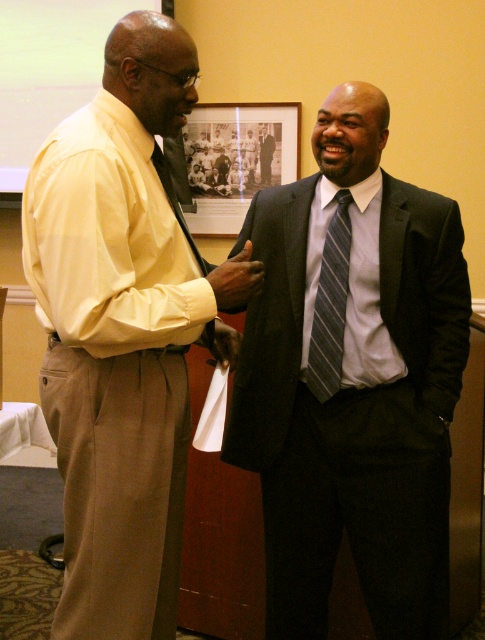
In the scene shown: You are a photographer at a formal event and need to ensure that both the light blue cotton dress shirt at center and the matte black phone at center are clearly visible in your photo. Given their sizes, which object will require more space in the frame to capture its details?

The light blue cotton dress shirt at center is larger in size than the matte black phone at center, so it will require more space in the frame to capture its details.

You are a photographer who wants to capture a closeup of both the light blue cotton dress shirt at center and the matte black phone at center in the image. The camera you are using has a maximum focus range of 10 inches. Will you be able to focus on both objects simultaneously?

The light blue cotton dress shirt at center and the matte black phone at center are 11.60 inches apart. Since the camera can only focus on objects within 10 inches of each other, the distance between them exceeds the maximum focus range. Therefore, you cannot focus on both objects simultaneously.